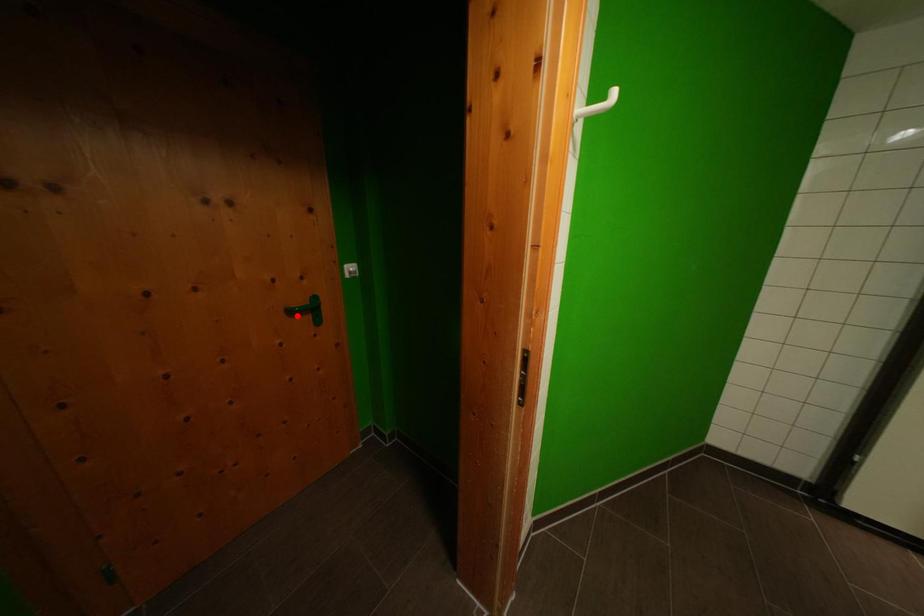
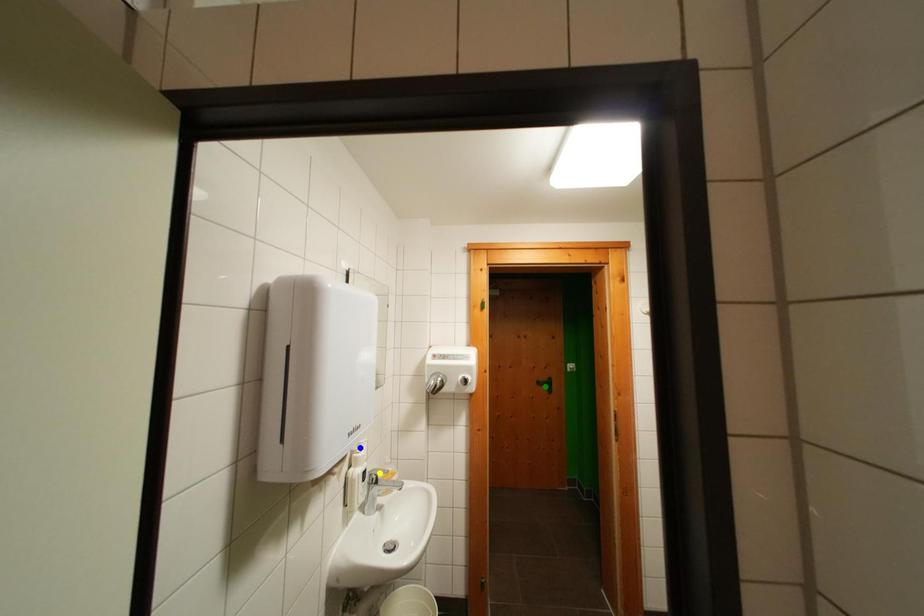
Question: I am providing you with two images of the same scene from different viewpoints. A red point is marked on the first image. You are given multiple points on the second image. Which point in image 2 is actually the same real-world point as the red point in image 1?

Choices:
 (A) blue point
 (B) yellow point
 (C) green point

Answer: (C)